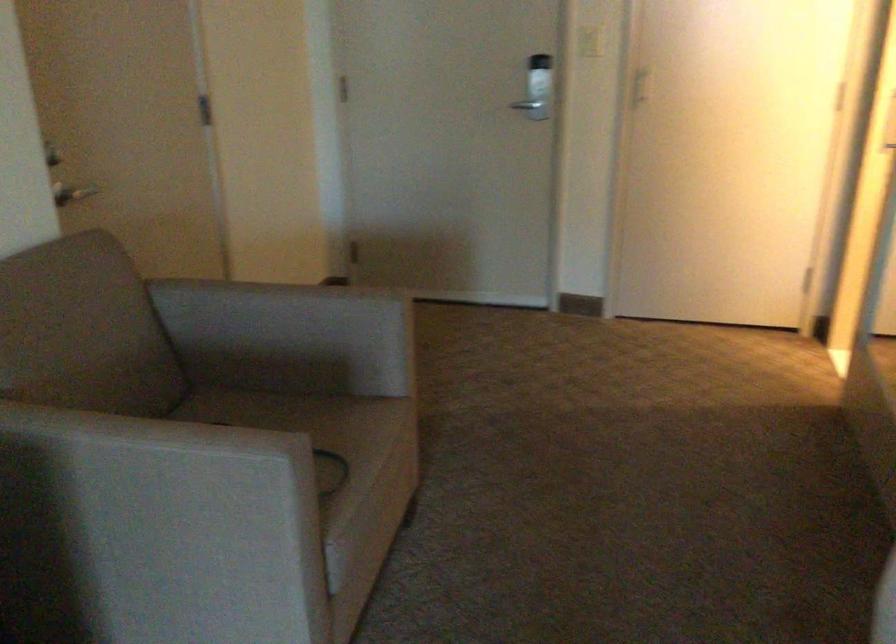
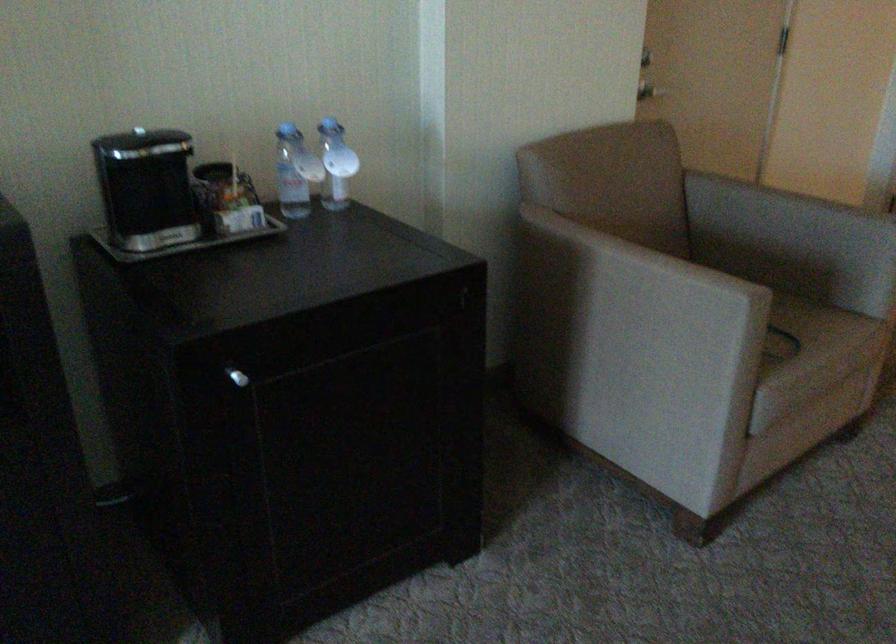
In the second image, find the point that corresponds to [142,475] in the first image.

(631, 283)